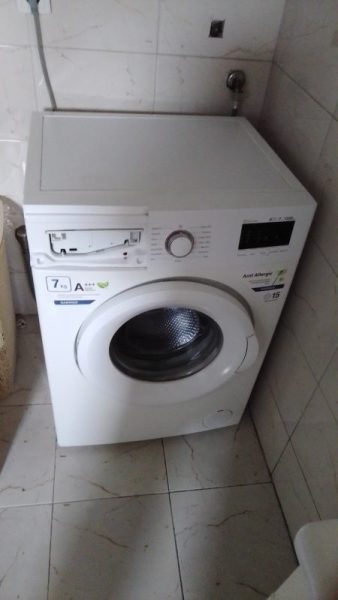
The height and width of the screenshot is (600, 338). I want to click on electric outlet, so click(215, 28).